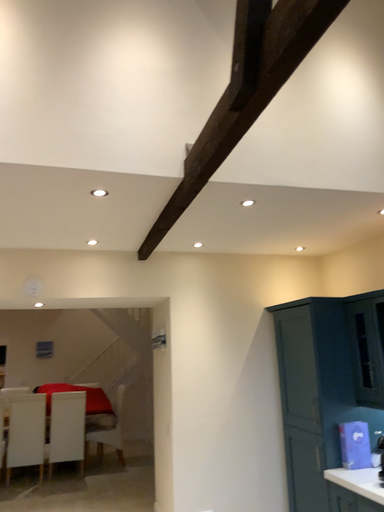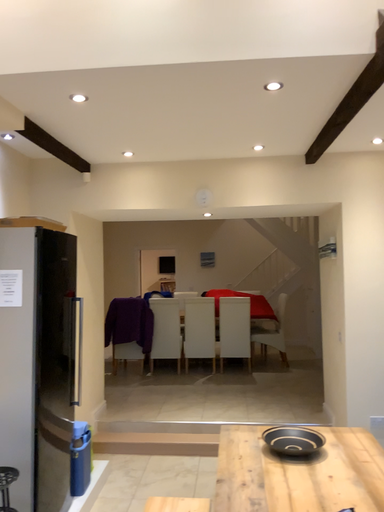
Question: Which way did the camera rotate in the video?

Choices:
 (A) rotated left
 (B) rotated right

Answer: (A)